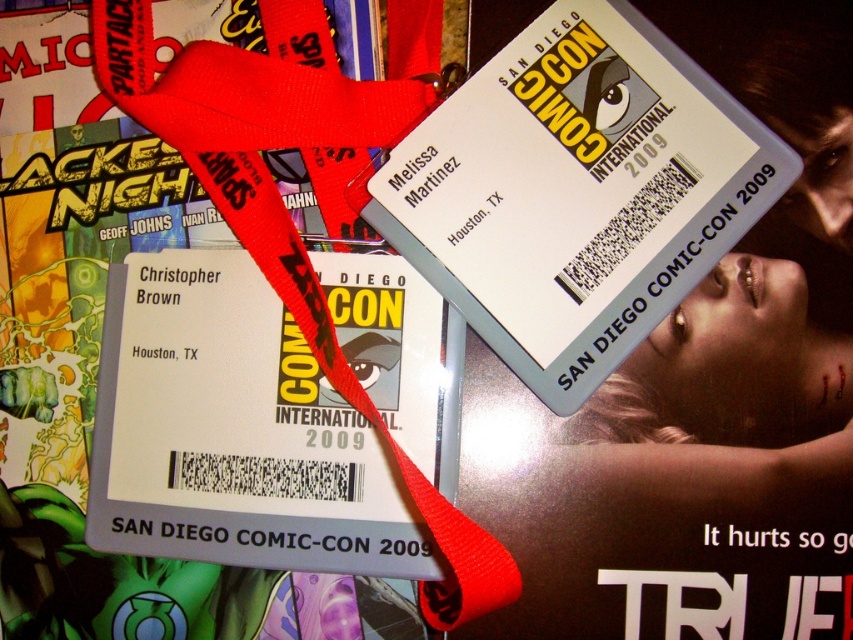
Based on the photo, you are holding a white plastic badge at center and a white cardstock ticket at center. Which one is closer to you?

The white plastic badge at center is closer to you since the white cardstock ticket at center is behind it.

You are looking at the image of two Comic Con badges. There is a point at coordinates (x=576, y=193). Which object does this point correspond to?

The point at coordinates (x=576, y=193) corresponds to the white plastic badge at center.